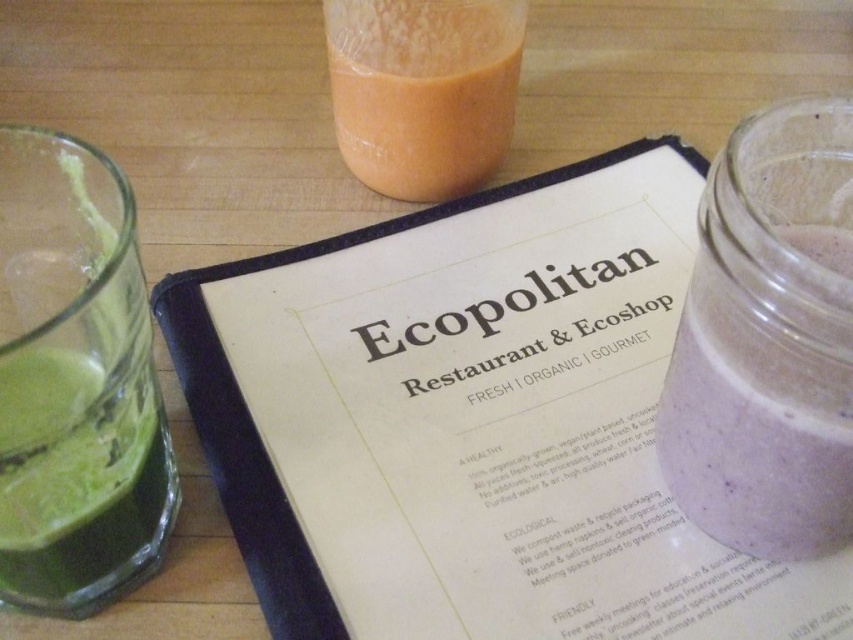
Is white paper menu at center closer to the viewer compared to orange translucent glass at upper center?

Yes.

Is white paper menu at center thinner than orange translucent glass at upper center?

Incorrect, white paper menu at center's width is not less than orange translucent glass at upper center's.

Is point (509, 637) positioned after point (376, 0)?

No, (509, 637) is closer to viewer.

Locate an element on the screen. white paper menu at center is located at coordinates (480, 422).

Is green glass at left below orange translucent glass at upper center?

Yes.

Is green glass at left taller than orange translucent glass at upper center?

Correct, green glass at left is much taller as orange translucent glass at upper center.

You are a GUI agent. You are given a task and a screenshot of the screen. Output one action in this format:
    pyautogui.click(x=<x>, y=<y>)
    Task: Click on the green glass at left
    The image size is (853, 640).
    Given the screenshot: What is the action you would take?
    pyautogui.click(x=74, y=380)

Where is `green glass at left`? green glass at left is located at coordinates (74, 380).

Is white paper menu at center thinner than purple smoothie at right?

Incorrect, white paper menu at center's width is not less than purple smoothie at right's.

Who is taller, white paper menu at center or purple smoothie at right?

With more height is white paper menu at center.

The image size is (853, 640). Identify the location of white paper menu at center. (480, 422).

Find the location of a particular element. white paper menu at center is located at coordinates (480, 422).